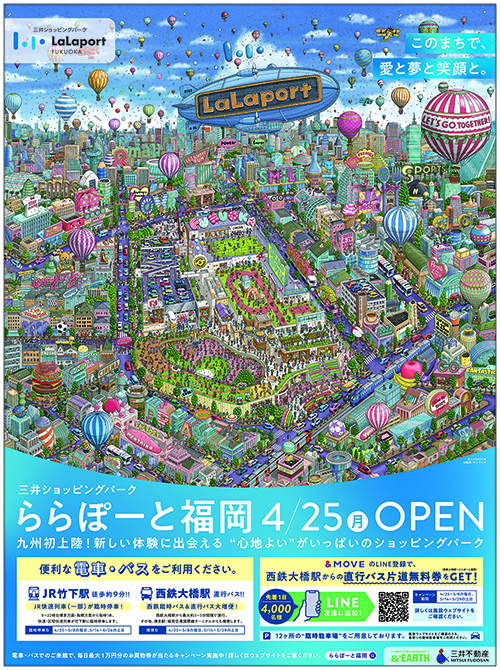
Image resolution: width=500 pixels, height=670 pixels. In order to click on globe in this screenshot , I will do `click(21, 411)`.